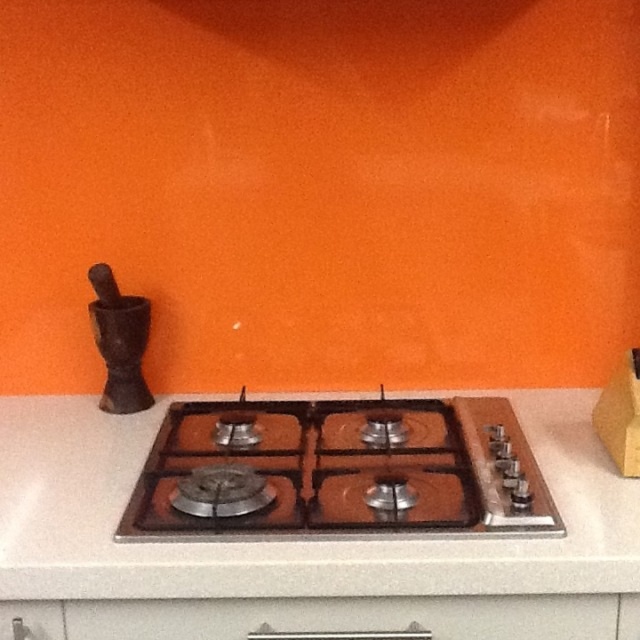
Describe the element at coordinates (348, 616) in the screenshot. I see `white matte drawer at center` at that location.

Between point (296, 620) and point (16, 611), which one is positioned in front?

Point (296, 620) is more forward.

Is point (212, 624) farther from viewer compared to point (36, 612)?

Yes.

Locate an element on the screen. The width and height of the screenshot is (640, 640). white matte drawer at center is located at coordinates (348, 616).

The height and width of the screenshot is (640, 640). What are the coordinates of `satin silver gas stove at center` in the screenshot? It's located at (339, 470).

Is point (500, 426) closer to viewer compared to point (326, 609)?

No, it is not.

You are a GUI agent. You are given a task and a screenshot of the screen. Output one action in this format:
    pyautogui.click(x=<x>, y=<y>)
    Task: Click on the satin silver gas stove at center
    
    Given the screenshot: What is the action you would take?
    pyautogui.click(x=339, y=470)

Who is more distant from viewer, (376, 515) or (52, 628)?

Positioned behind is point (376, 515).

Can you confirm if satin silver gas stove at center is thinner than brushed metal drawer at lower left?

No, satin silver gas stove at center is not thinner than brushed metal drawer at lower left.

Between point (317, 509) and point (51, 632), which one is positioned in front?

Point (51, 632) is more forward.

Locate an element on the screen. This screenshot has height=640, width=640. satin silver gas stove at center is located at coordinates (339, 470).